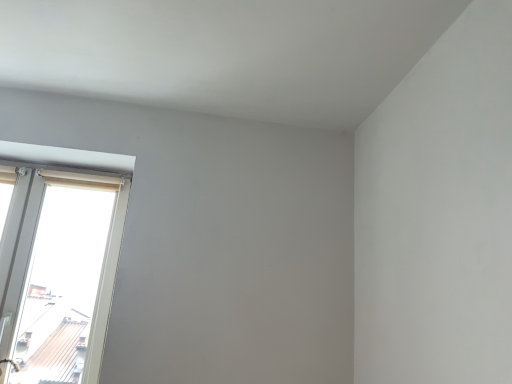
Describe the element at coordinates (58, 267) in the screenshot. I see `white plastic window at left` at that location.

In order to face white plastic window at left, should I rotate leftwards or rightwards?

Rotate your view left by about 26.285°.

At what (x,y) coordinates should I click in order to perform the action: click on white plastic window at left. Please return your answer as a coordinate pair (x, y). Looking at the image, I should click on (58, 267).

Identify the location of white plastic window at left. The image size is (512, 384). (58, 267).